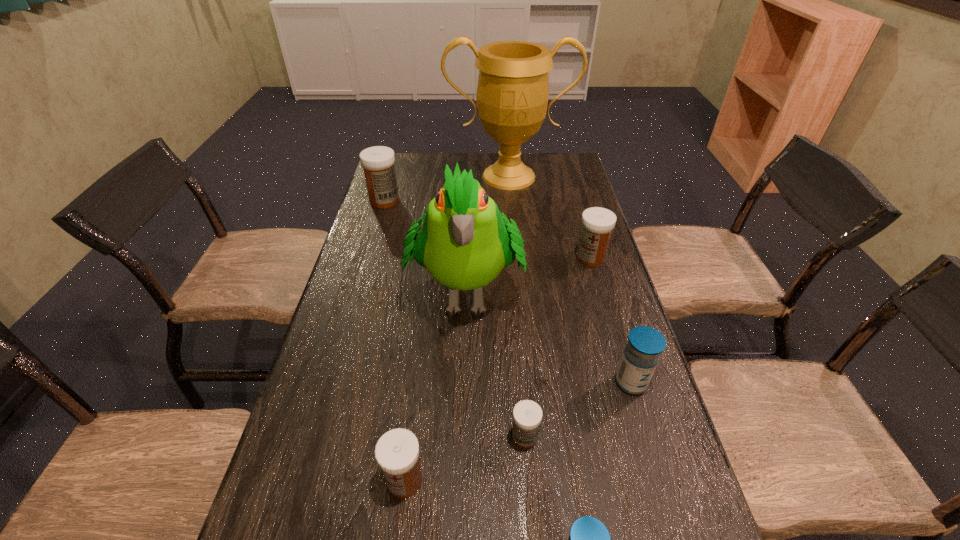
Find the location of a particular element. The width and height of the screenshot is (960, 540). the third medicine from left to right is located at coordinates (527, 415).

You are a GUI agent. You are given a task and a screenshot of the screen. Output one action in this format:
    pyautogui.click(x=<x>, y=<y>)
    Task: Click on the second white medicine from right to left
    
    Given the screenshot: What is the action you would take?
    pyautogui.click(x=527, y=415)

Locate an element on the screen. Image resolution: width=960 pixels, height=540 pixels. free space located on the engravings side of the trophy is located at coordinates (513, 218).

The image size is (960, 540). Find the location of `free space located 0.080m on the beak of the green parakeet`. free space located 0.080m on the beak of the green parakeet is located at coordinates (463, 376).

The height and width of the screenshot is (540, 960). What are the coordinates of `vacant region located 0.280m on the right of the farthest medicine` in the screenshot? It's located at (480, 201).

In order to click on free location located on the back of the fourth nearest medicine in this screenshot , I will do `click(595, 263)`.

The width and height of the screenshot is (960, 540). Identify the location of free space located on the back of the second biggest white medicine. (570, 189).

In order to click on vacant space located 0.260m on the back of the second smallest white medicine in this screenshot , I will do `click(420, 354)`.

Find the location of `vacant region located 0.180m on the back of the fourth medicine from right to left`. vacant region located 0.180m on the back of the fourth medicine from right to left is located at coordinates (518, 355).

Find the location of a particular element. This screenshot has width=960, height=540. object that is at the far edge is located at coordinates (512, 95).